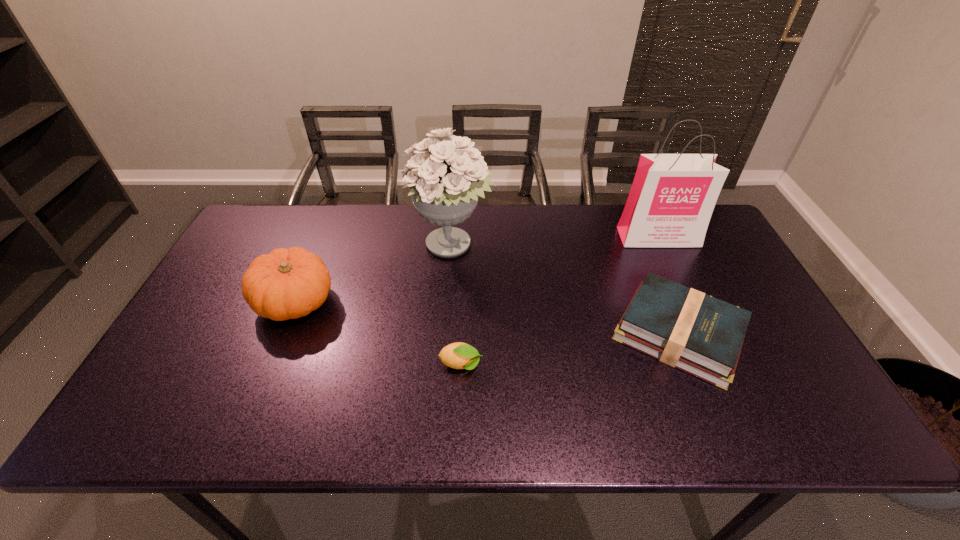
The width and height of the screenshot is (960, 540). Identify the location of bouquet. (445, 186).

You are a GUI agent. You are given a task and a screenshot of the screen. Output one action in this format:
    pyautogui.click(x=<x>, y=<y>)
    Task: Click on the shopping bag
    The height and width of the screenshot is (540, 960).
    Given the screenshot: What is the action you would take?
    pyautogui.click(x=672, y=198)

Image resolution: width=960 pixels, height=540 pixels. I want to click on pumpkin, so [290, 283].

Identify the location of the third shortest object. This screenshot has width=960, height=540. (290, 283).

Identify the location of hardback book. The width and height of the screenshot is (960, 540). (687, 329).

The height and width of the screenshot is (540, 960). I want to click on lemon, so click(459, 355).

The width and height of the screenshot is (960, 540). In order to click on vacant space positioned 0.070m on the back of the bouquet in this screenshot , I will do `click(455, 210)`.

Identify the location of vacant region located on the front-facing side of the shopping bag. Image resolution: width=960 pixels, height=540 pixels. (683, 292).

Where is `free space located on the left of the third tallest object`? This screenshot has width=960, height=540. free space located on the left of the third tallest object is located at coordinates (198, 301).

At what (x,y) coordinates should I click in order to perform the action: click on free spot located on the left of the hardback book. Please return your answer as a coordinate pair (x, y). This screenshot has height=540, width=960. Looking at the image, I should click on (455, 334).